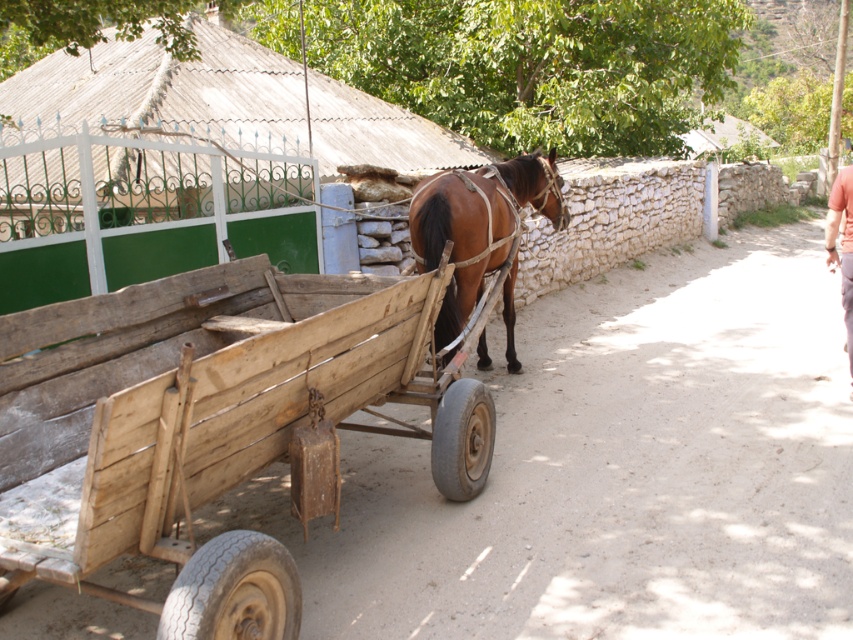
Question: Considering the real-world distances, which object is closest to the pink fabric pants at lower right?

Choices:
 (A) wooden cart at center
 (B) brown glossy horse at center

Answer: (B)

Question: Is wooden cart at center closer to camera compared to brown glossy horse at center?

Choices:
 (A) yes
 (B) no

Answer: (A)

Question: Does wooden cart at center have a greater width compared to pink fabric pants at lower right?

Choices:
 (A) no
 (B) yes

Answer: (B)

Question: Is wooden cart at center to the right of brown glossy horse at center from the viewer's perspective?

Choices:
 (A) yes
 (B) no

Answer: (B)

Question: Based on their relative distances, which object is farther from the pink fabric pants at lower right?

Choices:
 (A) wooden cart at center
 (B) brown glossy horse at center

Answer: (A)

Question: Which of the following is the farthest from the observer?

Choices:
 (A) (421, 353)
 (B) (550, 177)
 (C) (848, 323)

Answer: (B)